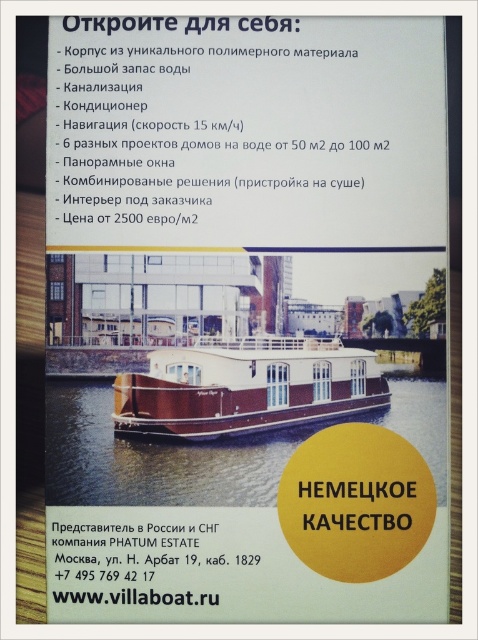
You are a customer looking at this advertisement and want to know if the brown wooden boat at center can be seen from the brown polished wood boat at center. Based on the image description, can you determine this?

The brown wooden boat at center is positioned under the brown polished wood boat at center, so the brown wooden boat at center would be obscured and not visible from the brown polished wood boat at center.

You are a customer looking to purchase a houseboat and see the brown wooden boat at center and the brown polished wood boat at center in the image. Which one is more to the left?

The brown wooden boat at center is more to the left than the brown polished wood boat at center.